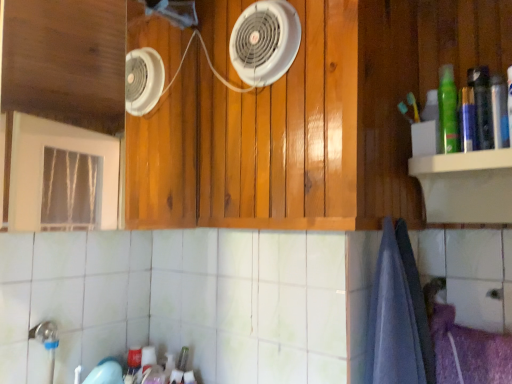
Question: Is white plastic fan at upper center completely or partially outside of green matte bottle at upper right?

Choices:
 (A) no
 (B) yes

Answer: (B)

Question: From the image's perspective, is white plastic fan at upper center located beneath green matte bottle at upper right?

Choices:
 (A) no
 (B) yes

Answer: (A)

Question: Does white plastic fan at upper center touch green matte bottle at upper right?

Choices:
 (A) yes
 (B) no

Answer: (B)

Question: Does white plastic fan at upper center appear on the left side of green matte bottle at upper right?

Choices:
 (A) no
 (B) yes

Answer: (B)

Question: Is white plastic fan at upper center taller than green matte bottle at upper right?

Choices:
 (A) yes
 (B) no

Answer: (A)

Question: Looking at their shapes, would you say green matte bottle at upper right is wider or thinner than blue cotton bath towel at lower right?

Choices:
 (A) wide
 (B) thin

Answer: (B)

Question: Is green matte bottle at upper right taller or shorter than blue cotton bath towel at lower right?

Choices:
 (A) short
 (B) tall

Answer: (A)

Question: Considering the relative positions of green matte bottle at upper right and blue cotton bath towel at lower right in the image provided, is green matte bottle at upper right to the left or to the right of blue cotton bath towel at lower right?

Choices:
 (A) right
 (B) left

Answer: (A)

Question: Considering the positions of green matte bottle at upper right and blue cotton bath towel at lower right in the image, is green matte bottle at upper right bigger or smaller than blue cotton bath towel at lower right?

Choices:
 (A) big
 (B) small

Answer: (B)

Question: Looking at the image, does blue cotton bath towel at lower right seem bigger or smaller compared to wooden cabinet at center?

Choices:
 (A) big
 (B) small

Answer: (A)

Question: Considering the positions of point (406, 326) and point (180, 74), is point (406, 326) closer or farther from the camera than point (180, 74)?

Choices:
 (A) farther
 (B) closer

Answer: (B)

Question: In terms of width, does blue cotton bath towel at lower right look wider or thinner when compared to wooden cabinet at center?

Choices:
 (A) thin
 (B) wide

Answer: (B)

Question: Based on their positions, is blue cotton bath towel at lower right located to the left or right of wooden cabinet at center?

Choices:
 (A) right
 (B) left

Answer: (A)

Question: Is blue cotton bath towel at lower right in front of or behind white plastic fan at upper center in the image?

Choices:
 (A) front
 (B) behind

Answer: (A)

Question: In terms of width, does blue cotton bath towel at lower right look wider or thinner when compared to white plastic fan at upper center?

Choices:
 (A) wide
 (B) thin

Answer: (A)